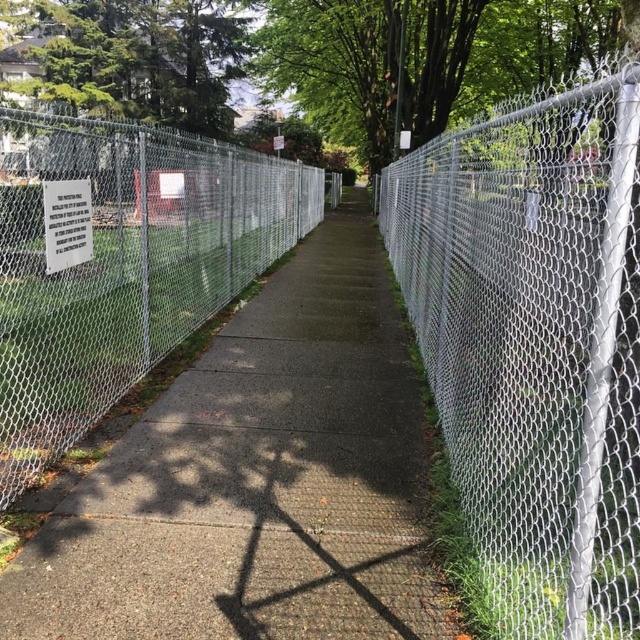
Question: Which of the following is the farthest from the observer?

Choices:
 (A) (8, 573)
 (B) (288, 205)
 (C) (566, 417)

Answer: (B)

Question: Considering the real-world distances, which object is farthest from the gray concrete sidewalk at center?

Choices:
 (A) white plastic sign at center
 (B) silver chain-link fence at left
 (C) silver chain-link fence at right

Answer: (B)

Question: Among these objects, which one is farthest from the camera?

Choices:
 (A) silver chain-link fence at right
 (B) white plastic sign at center
 (C) gray concrete sidewalk at center
 (D) silver chain-link fence at left

Answer: (B)

Question: Can you confirm if gray concrete sidewalk at center is positioned to the left of silver chain-link fence at left?

Choices:
 (A) no
 (B) yes

Answer: (A)

Question: Is gray concrete sidewalk at center to the left of white plastic sign at center from the viewer's perspective?

Choices:
 (A) no
 (B) yes

Answer: (A)

Question: Is gray concrete sidewalk at center smaller than silver chain-link fence at right?

Choices:
 (A) no
 (B) yes

Answer: (B)